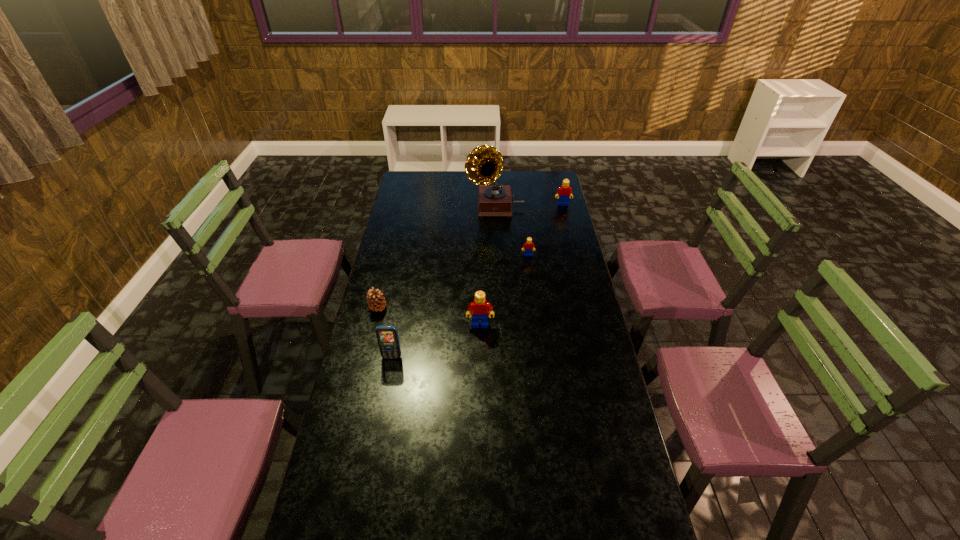
Find the location of `the leftmost Lego`. the leftmost Lego is located at coordinates (479, 307).

Locate an element on the screen. The height and width of the screenshot is (540, 960). the nearest Lego is located at coordinates (479, 307).

Locate an element on the screen. Image resolution: width=960 pixels, height=540 pixels. the shortest Lego is located at coordinates (528, 245).

You are a GUI agent. You are given a task and a screenshot of the screen. Output one action in this format:
    pyautogui.click(x=<x>, y=<y>)
    Task: Click on the second nearest Lego
    The height and width of the screenshot is (540, 960).
    Given the screenshot: What is the action you would take?
    pyautogui.click(x=528, y=245)

You are a GUI agent. You are given a task and a screenshot of the screen. Output one action in this format:
    pyautogui.click(x=<x>, y=<y>)
    Task: Click on the farthest Lego
    This screenshot has width=960, height=540.
    Given the screenshot: What is the action you would take?
    pyautogui.click(x=564, y=192)

Find the location of a particular element. the rightmost object is located at coordinates (564, 192).

You are a GUI agent. You are given a task and a screenshot of the screen. Output one action in this format:
    pyautogui.click(x=<x>, y=<y>)
    Task: Click on the tallest object
    
    Given the screenshot: What is the action you would take?
    pyautogui.click(x=484, y=164)

The height and width of the screenshot is (540, 960). I want to click on cellular telephone, so click(x=387, y=336).

The height and width of the screenshot is (540, 960). What are the coordinates of `the nearest object` in the screenshot? It's located at (387, 336).

The height and width of the screenshot is (540, 960). Find the location of `pinecone`. pinecone is located at coordinates (376, 302).